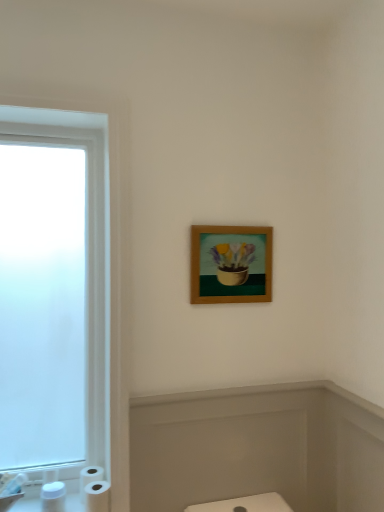
Question: Does white matte toilet paper at lower left have a lesser height compared to matte white bathtub at lower center?

Choices:
 (A) yes
 (B) no

Answer: (A)

Question: From the image's perspective, is white matte toilet paper at lower left located above matte white bathtub at lower center?

Choices:
 (A) yes
 (B) no

Answer: (B)

Question: From a real-world perspective, does white matte toilet paper at lower left stand above matte white bathtub at lower center?

Choices:
 (A) yes
 (B) no

Answer: (B)

Question: Does white matte toilet paper at lower left have a smaller size compared to matte white bathtub at lower center?

Choices:
 (A) no
 (B) yes

Answer: (B)

Question: Is white matte toilet paper at lower left at the left side of matte white bathtub at lower center?

Choices:
 (A) no
 (B) yes

Answer: (B)

Question: Considering the relative sizes of white matte toilet paper at lower left and matte white bathtub at lower center in the image provided, is white matte toilet paper at lower left taller than matte white bathtub at lower center?

Choices:
 (A) no
 (B) yes

Answer: (A)

Question: Is matte white bathtub at lower center at the left side of wooden frame at upper center?

Choices:
 (A) yes
 (B) no

Answer: (A)

Question: From the image's perspective, would you say matte white bathtub at lower center is shown under wooden frame at upper center?

Choices:
 (A) yes
 (B) no

Answer: (A)

Question: From the image's perspective, is matte white bathtub at lower center located above wooden frame at upper center?

Choices:
 (A) no
 (B) yes

Answer: (A)

Question: Is matte white bathtub at lower center outside wooden frame at upper center?

Choices:
 (A) no
 (B) yes

Answer: (B)

Question: Is matte white bathtub at lower center taller than wooden frame at upper center?

Choices:
 (A) no
 (B) yes

Answer: (B)

Question: Can you confirm if matte white bathtub at lower center is bigger than wooden frame at upper center?

Choices:
 (A) no
 (B) yes

Answer: (B)

Question: From the image's perspective, is white glossy sink at lower left under white matte toilet paper at lower left?

Choices:
 (A) yes
 (B) no

Answer: (B)